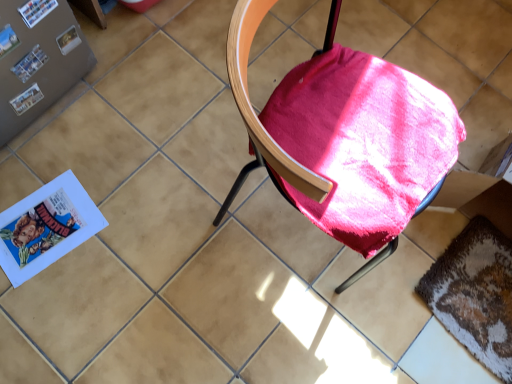
The height and width of the screenshot is (384, 512). Find the location of `matte plastic paperback book at upper left, acting as the 2th paperback book starting from the front`. matte plastic paperback book at upper left, acting as the 2th paperback book starting from the front is located at coordinates (30, 64).

I want to click on velvet-like pink cushion at center, so click(256, 115).

Between matte paper paperback book at upper left, acting as the 1th paperback book starting from the front, and matte plastic paperback book at upper left, placed as the first paperback book when sorted from bottom to top, which one has more height?

matte plastic paperback book at upper left, placed as the first paperback book when sorted from bottom to top, is taller.

From a real-world perspective, is matte paper paperback book at upper left, acting as the 1th paperback book starting from the front, located higher than matte plastic paperback book at upper left, acting as the 2th paperback book starting from the front?

Indeed, from a real-world perspective, matte paper paperback book at upper left, acting as the 1th paperback book starting from the front, stands above matte plastic paperback book at upper left, acting as the 2th paperback book starting from the front.

Is matte paper paperback book at upper left, which is the 1th paperback book in top-to-bottom order, in front of or behind matte plastic paperback book at upper left, placed as the first paperback book when sorted from bottom to top, in the image?

In the image, matte paper paperback book at upper left, which is the 1th paperback book in top-to-bottom order, appears in front of matte plastic paperback book at upper left, placed as the first paperback book when sorted from bottom to top.

Can you tell me how much matte paper paperback book at upper left, arranged as the 2th paperback book when viewed from the back, and matte plastic paperback book at upper left, placed as the first paperback book when sorted from bottom to top, differ in facing direction?

0.00606 degrees separate the facing orientations of matte paper paperback book at upper left, arranged as the 2th paperback book when viewed from the back, and matte plastic paperback book at upper left, placed as the first paperback book when sorted from bottom to top.

Which point is more distant from viewer, (19, 9) or (445, 266)?

The point (445, 266) is farther.

Is matte paper paperback book at upper left, which is the 2th paperback book from bottom to top, taller than textured brown mat at lower right?

Correct, matte paper paperback book at upper left, which is the 2th paperback book from bottom to top, is much taller as textured brown mat at lower right.

Find the location of `mat below the matte paper paperback book at upper left, which is the 1th paperback book in top-to-bottom order (from the image's perspective)`. mat below the matte paper paperback book at upper left, which is the 1th paperback book in top-to-bottom order (from the image's perspective) is located at coordinates (475, 293).

Is matte paper paperback book at upper left, which is the 2th paperback book from bottom to top, in contact with textured brown mat at lower right?

No, matte paper paperback book at upper left, which is the 2th paperback book from bottom to top, is not next to textured brown mat at lower right.

Do you think textured brown mat at lower right is within matte plastic paperback book at upper left, the 1th paperback book when ordered from back to front, or outside of it?

textured brown mat at lower right is not enclosed by matte plastic paperback book at upper left, the 1th paperback book when ordered from back to front.

How many degrees apart are the facing directions of textured brown mat at lower right and matte plastic paperback book at upper left, acting as the 2th paperback book starting from the front?

174 degrees.

Is textured brown mat at lower right far from matte plastic paperback book at upper left, the 2th paperback book in the top-to-bottom sequence?

Absolutely, textured brown mat at lower right is distant from matte plastic paperback book at upper left, the 2th paperback book in the top-to-bottom sequence.

Is textured brown mat at lower right shorter than matte plastic paperback book at upper left, the 1th paperback book when ordered from back to front?

Correct, textured brown mat at lower right is not as tall as matte plastic paperback book at upper left, the 1th paperback book when ordered from back to front.

Is textured brown mat at lower right positioned with its back to velvet-like pink cushion at center?

That's not correct — textured brown mat at lower right is not looking away from velvet-like pink cushion at center.

Does textured brown mat at lower right have a lesser height compared to velvet-like pink cushion at center?

Yes.

How different are the orientations of textured brown mat at lower right and velvet-like pink cushion at center in degrees?

There is a 160-degree angle between the facing directions of textured brown mat at lower right and velvet-like pink cushion at center.

Find the location of `mat directly beneath the velvet-like pink cushion at center (from a real-world perspective)`. mat directly beneath the velvet-like pink cushion at center (from a real-world perspective) is located at coordinates (475, 293).

Does velvet-like pink cushion at center appear on the right side of textured brown mat at lower right?

No.

Which is behind, point (236, 20) or point (433, 277)?

Point (433, 277)

From the image's perspective, who appears lower, velvet-like pink cushion at center or textured brown mat at lower right?

From the image's view, textured brown mat at lower right is below.

Which is behind, point (14, 69) or point (28, 20)?

The point (14, 69) is behind.

How many degrees apart are the facing directions of matte plastic paperback book at upper left, the 2th paperback book in the top-to-bottom sequence, and matte paper paperback book at upper left, acting as the 1th paperback book starting from the front?

The angular difference between matte plastic paperback book at upper left, the 2th paperback book in the top-to-bottom sequence, and matte paper paperback book at upper left, acting as the 1th paperback book starting from the front, is 0.00606 degrees.

Is matte plastic paperback book at upper left, placed as the first paperback book when sorted from bottom to top, outside of matte paper paperback book at upper left, which is the 2th paperback book from bottom to top?

Yes, matte plastic paperback book at upper left, placed as the first paperback book when sorted from bottom to top, is outside of matte paper paperback book at upper left, which is the 2th paperback book from bottom to top.

Can you confirm if textured brown mat at lower right is taller than matte paper paperback book at upper left, which is the 1th paperback book in top-to-bottom order?

Incorrect, the height of textured brown mat at lower right is not larger of that of matte paper paperback book at upper left, which is the 1th paperback book in top-to-bottom order.

From a real-world perspective, does textured brown mat at lower right stand above matte paper paperback book at upper left, acting as the 1th paperback book starting from the front?

No.

Considering the positions of point (454, 315) and point (30, 3), is point (454, 315) closer or farther from the camera than point (30, 3)?

Point (454, 315).

Can we say textured brown mat at lower right lies outside matte paper paperback book at upper left, acting as the 1th paperback book starting from the front?

Yes.

Identify the location of paperback book that appears on the right of matte plastic paperback book at upper left, the 1th paperback book when ordered from back to front. The height and width of the screenshot is (384, 512). 36,11.

From a real-world perspective, count 2nd paperback books upward from the textured brown mat at lower right and point to it. Please provide its 2D coordinates.

[(36, 11)]

Considering their positions, is textured brown mat at lower right positioned closer to matte plastic paperback book at upper left, placed as the first paperback book when sorted from bottom to top, than matte paper paperback book at upper left, which is the 1th paperback book in top-to-bottom order?

Answer: The object closer to matte plastic paperback book at upper left, placed as the first paperback book when sorted from bottom to top, is matte paper paperback book at upper left, which is the 1th paperback book in top-to-bottom order.

Looking at the image, which one is located closer to velvet-like pink cushion at center, matte paper paperback book at upper left, which is the 1th paperback book in top-to-bottom order, or textured brown mat at lower right?

textured brown mat at lower right is closer to velvet-like pink cushion at center.

From the image, which object appears to be nearer to matte plastic paperback book at upper left, the 1th paperback book when ordered from back to front, textured brown mat at lower right or velvet-like pink cushion at center?

Among the two, velvet-like pink cushion at center is located nearer to matte plastic paperback book at upper left, the 1th paperback book when ordered from back to front.

Consider the image. Considering their positions, is velvet-like pink cushion at center positioned closer to matte plastic paperback book at upper left, placed as the first paperback book when sorted from bottom to top, than matte paper paperback book at upper left, arranged as the 2th paperback book when viewed from the back?

Based on the image, matte paper paperback book at upper left, arranged as the 2th paperback book when viewed from the back, appears to be nearer to matte plastic paperback book at upper left, placed as the first paperback book when sorted from bottom to top.

Looking at the image, which one is located closer to textured brown mat at lower right, matte paper paperback book at upper left, which is the 2th paperback book from bottom to top, or matte plastic paperback book at upper left, acting as the 2th paperback book starting from the front?

matte plastic paperback book at upper left, acting as the 2th paperback book starting from the front, is closer to textured brown mat at lower right.

Looking at the image, which one is located closer to velvet-like pink cushion at center, matte plastic paperback book at upper left, the 1th paperback book when ordered from back to front, or textured brown mat at lower right?

textured brown mat at lower right lies closer to velvet-like pink cushion at center than the other object.

Which object lies nearer to the anchor point matte paper paperback book at upper left, arranged as the 2th paperback book when viewed from the back, matte plastic paperback book at upper left, placed as the first paperback book when sorted from bottom to top, or velvet-like pink cushion at center?

Among the two, matte plastic paperback book at upper left, placed as the first paperback book when sorted from bottom to top, is located nearer to matte paper paperback book at upper left, arranged as the 2th paperback book when viewed from the back.

Based on their spatial positions, is textured brown mat at lower right or matte plastic paperback book at upper left, the 1th paperback book when ordered from back to front, closer to matte paper paperback book at upper left, arranged as the 2th paperback book when viewed from the back?

matte plastic paperback book at upper left, the 1th paperback book when ordered from back to front.

You are a GUI agent. You are given a task and a screenshot of the screen. Output one action in this format:
    pyautogui.click(x=<x>, y=<y>)
    Task: Click on the paperback book between matte plastic paperback book at upper left, the 2th paperback book in the top-to-bottom sequence, and textured brown mat at lower right from left to right
    
    Given the screenshot: What is the action you would take?
    pyautogui.click(x=36, y=11)

Image resolution: width=512 pixels, height=384 pixels. I want to click on chair located between matte paper paperback book at upper left, which is the 1th paperback book in top-to-bottom order, and textured brown mat at lower right in the left-right direction, so click(x=256, y=115).

What are the coordinates of `chair between matte plastic paperback book at upper left, the 1th paperback book when ordered from back to front, and textured brown mat at lower right from left to right` in the screenshot? It's located at (256, 115).

Locate an element on the screen. paperback book between matte plastic paperback book at upper left, acting as the 2th paperback book starting from the front, and velvet-like pink cushion at center is located at coordinates (36, 11).